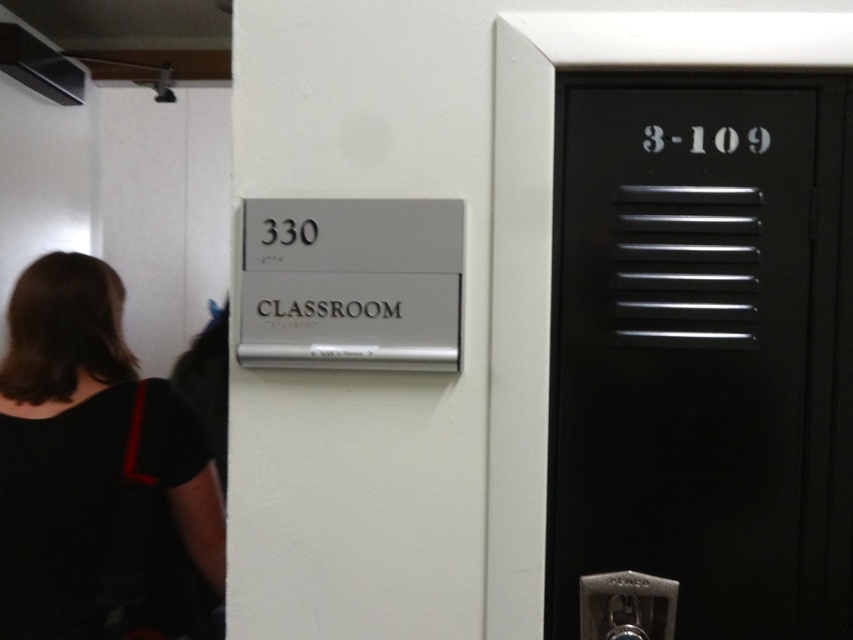
Question: Observing the image, what is the correct spatial positioning of black fabric at left in reference to black metal elevator at right?

Choices:
 (A) left
 (B) right

Answer: (A)

Question: Considering the relative positions of black fabric at left and black metal elevator at right in the image provided, where is black fabric at left located with respect to black metal elevator at right?

Choices:
 (A) below
 (B) above

Answer: (A)

Question: Which of the following is the farthest from the observer?

Choices:
 (A) (16, 436)
 (B) (573, 17)

Answer: (A)

Question: Which point is farther from the camera taking this photo?

Choices:
 (A) (515, 288)
 (B) (59, 572)

Answer: (B)

Question: Can you confirm if black fabric at left is thinner than black metal elevator at right?

Choices:
 (A) no
 (B) yes

Answer: (B)

Question: Which point is closer to the camera taking this photo?

Choices:
 (A) (506, 108)
 (B) (73, 504)

Answer: (A)